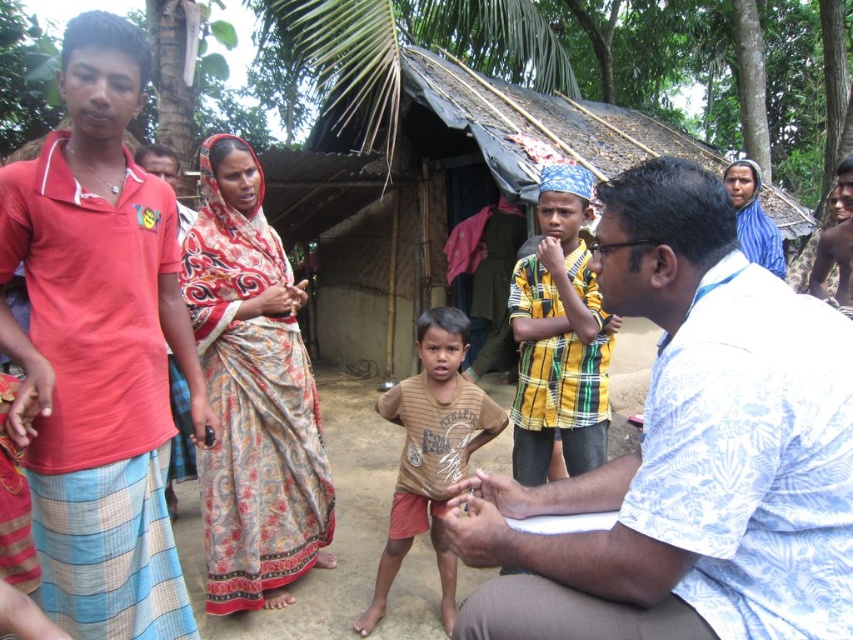
Can you confirm if red cotton shirt at left is bigger than printed silk sari at center?

Correct, red cotton shirt at left is larger in size than printed silk sari at center.

Can you confirm if red cotton shirt at left is positioned below printed silk sari at center?

Incorrect, red cotton shirt at left is not positioned below printed silk sari at center.

This screenshot has height=640, width=853. What are the coordinates of `red cotton shirt at left` in the screenshot? It's located at (99, 349).

Measure the distance between printed silk sari at center and brown cotton shirt at center.

They are 25.41 inches apart.

Is printed silk sari at center to the right of brown cotton shirt at center from the viewer's perspective?

Incorrect, printed silk sari at center is not on the right side of brown cotton shirt at center.

The image size is (853, 640). Describe the element at coordinates (252, 392) in the screenshot. I see `printed silk sari at center` at that location.

This screenshot has width=853, height=640. Identify the location of printed silk sari at center. (252, 392).

Does white floral shirt at center appear on the left side of blue printed sari at upper right?

Correct, you'll find white floral shirt at center to the left of blue printed sari at upper right.

Can you confirm if white floral shirt at center is thinner than blue printed sari at upper right?

No, white floral shirt at center is not thinner than blue printed sari at upper right.

Identify the location of white floral shirt at center. The image size is (853, 640). (688, 452).